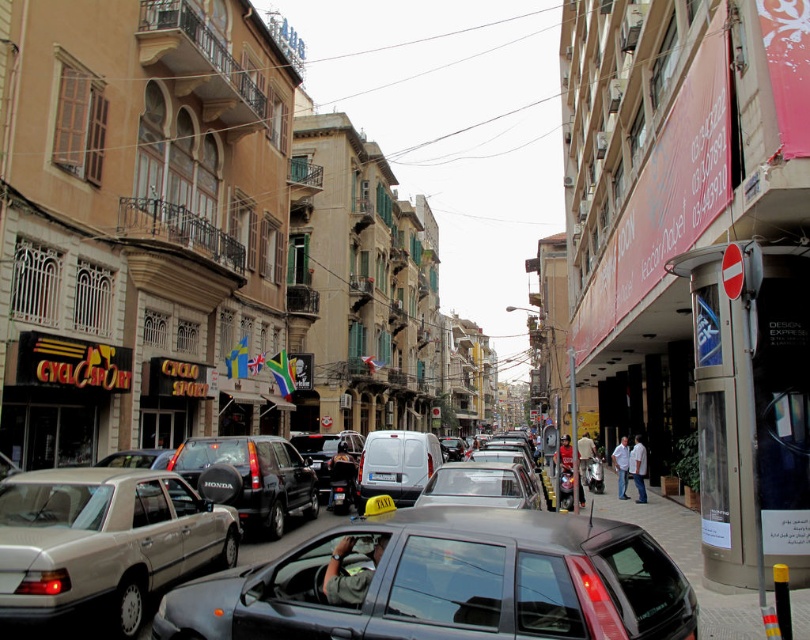
You are a delivery driver who needs to park your 2.8 meters long delivery van between the black glossy car at center and the silver metallic sedan at center. Can you fit your van between them without touching either vehicle?

The distance between the black glossy car at center and the silver metallic sedan at center is 3.15 meters. Since your van is 2.8 meters long, there is enough space to park it between them without touching either vehicle.

You are standing at the point marked as point [20,564] in the image. You want to walk to a nearby park that is 5 meters away from your current position. Can you reach the park without moving more than 5 meters?

The distance between point [20,564] and the viewer is 6.24 meters. Since the park is only 5 meters away from your current position, you cannot reach it without exceeding the 5 meter limit.

You are a delivery driver who needs to park your vehicle at the center of the street. The parking spot is marked by a point at coordinates (254, 477). What type of vehicle is currently occupying the parking spot?

The point at coordinates (254, 477) indicates a matte black suv at center, so the parking spot is occupied by a matte black suv at center.